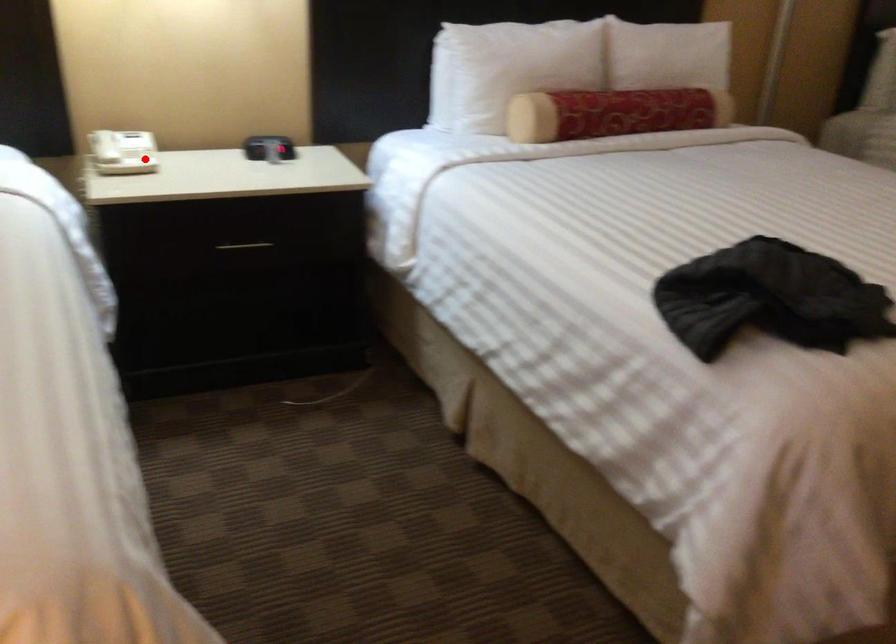
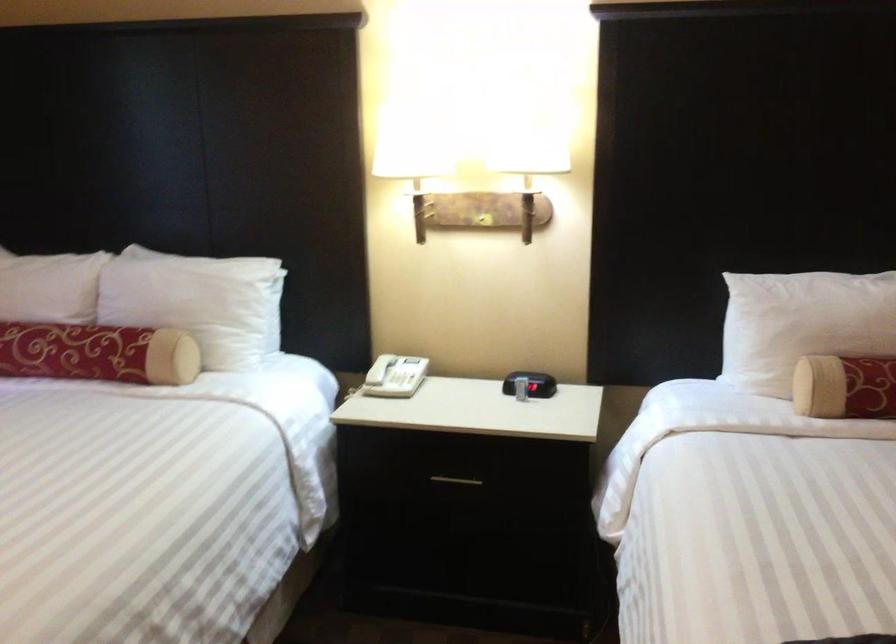
Question: I am providing you with two images of the same scene from different viewpoints. A red point is marked on the first image. Can you still see the location of the red point in image 2?

Choices:
 (A) Yes
 (B) No

Answer: (A)